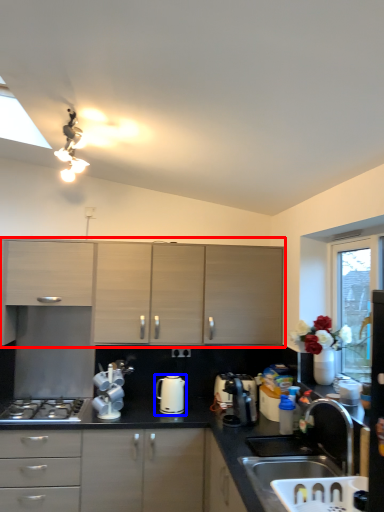
Question: Which of the following is the farthest to the observer, cabinetry (highlighted by a red box) or kitchen appliance (highlighted by a blue box)?

Choices:
 (A) cabinetry
 (B) kitchen appliance

Answer: (A)